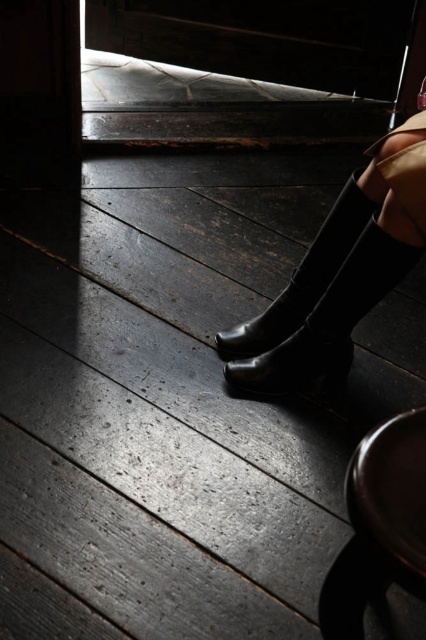
You are standing in a dimly lit room with a wooden floor. You see two boots at the center of the floor, a shiny black boot at center and a rubber matte boot at center. Which boot is closer to you?

The shiny black boot at center is closer to you because it is in front of the rubber matte boot at center.